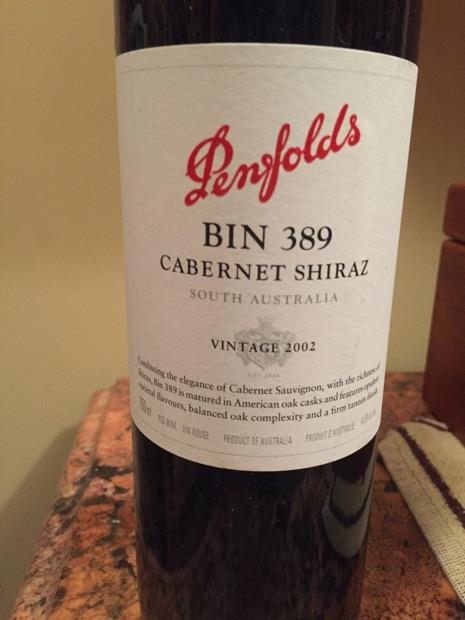
I want to click on wall, so click(x=84, y=268).